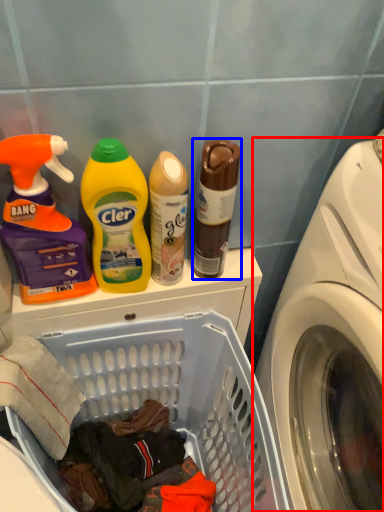
Question: Among these objects, which one is farthest to the camera, washing machine (highlighted by a red box) or bottle (highlighted by a blue box)?

Choices:
 (A) washing machine
 (B) bottle

Answer: (B)